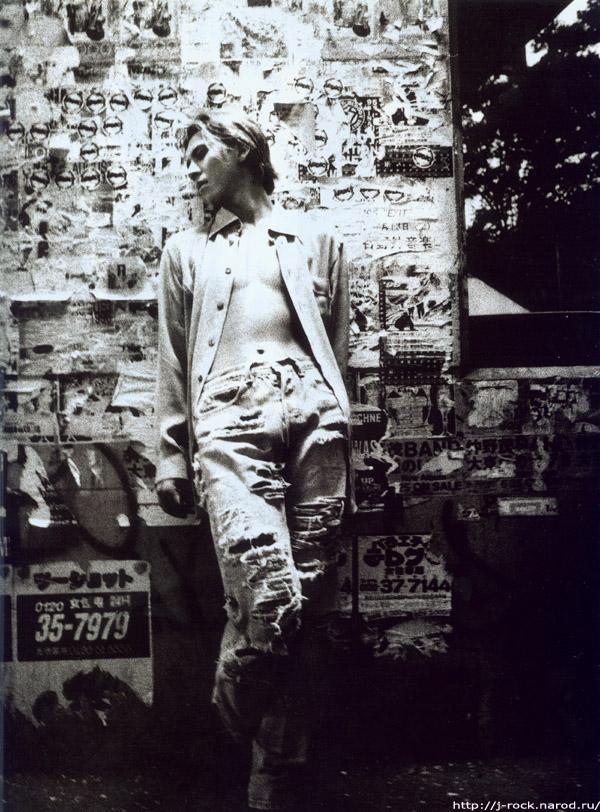
Where is `floor`? The image size is (600, 812). floor is located at coordinates (155, 792).